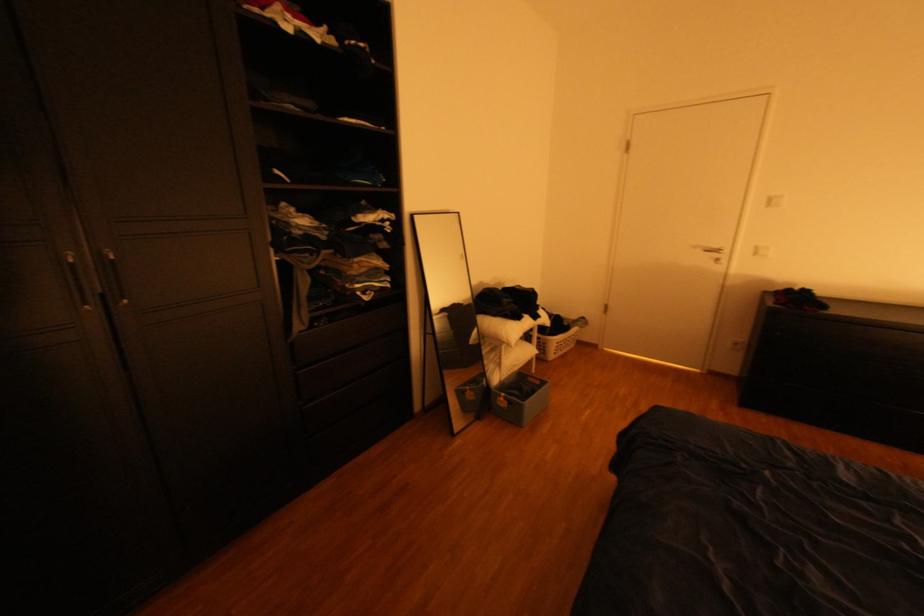
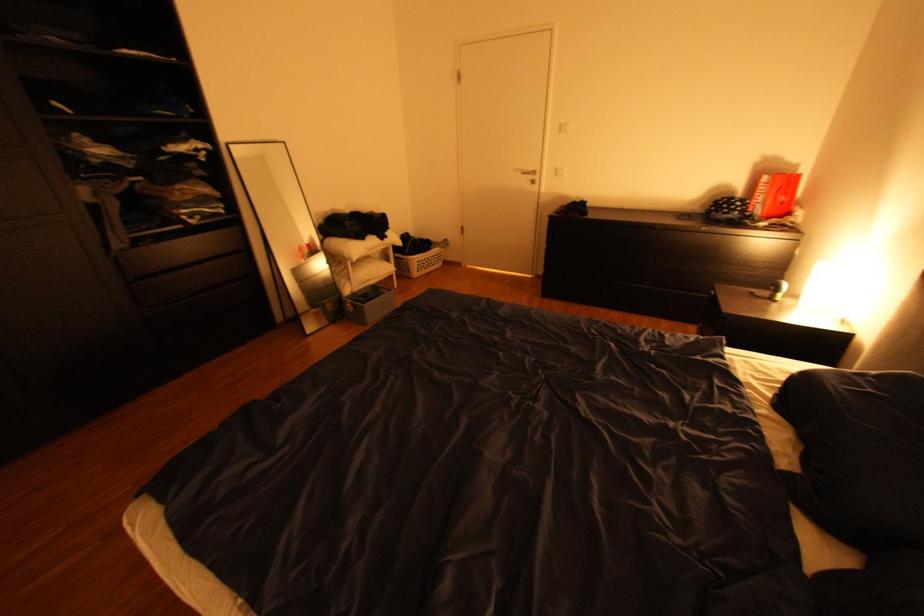
Where in the second image is the point corresponding to point 535,400 from the first image?

(373, 304)